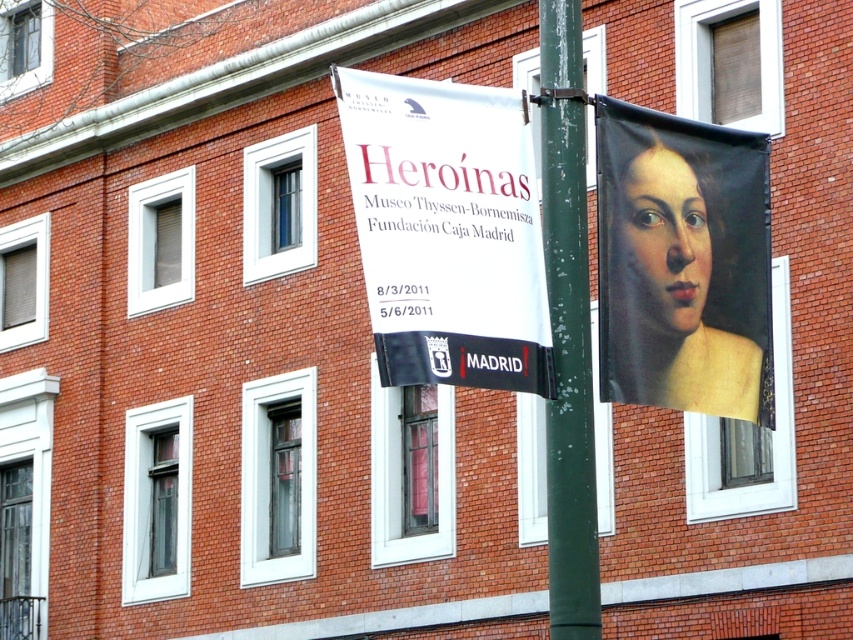
Question: Which of the following is the farthest from the observer?

Choices:
 (A) white paper banner at upper center
 (B) smooth canvas portrait at right
 (C) green painted metal pole at center

Answer: (B)

Question: Where is white paper banner at upper center located in relation to smooth canvas portrait at right in the image?

Choices:
 (A) above
 (B) below

Answer: (A)

Question: Which point is closer to the camera?

Choices:
 (A) green painted metal pole at center
 (B) smooth canvas portrait at right
 (C) white paper banner at upper center

Answer: (C)

Question: Is white paper banner at upper center bigger than smooth canvas portrait at right?

Choices:
 (A) no
 (B) yes

Answer: (B)

Question: Considering the real-world distances, which object is farthest from the green painted metal pole at center?

Choices:
 (A) smooth canvas portrait at right
 (B) white paper banner at upper center

Answer: (A)

Question: Is white paper banner at upper center above green painted metal pole at center?

Choices:
 (A) yes
 (B) no

Answer: (A)